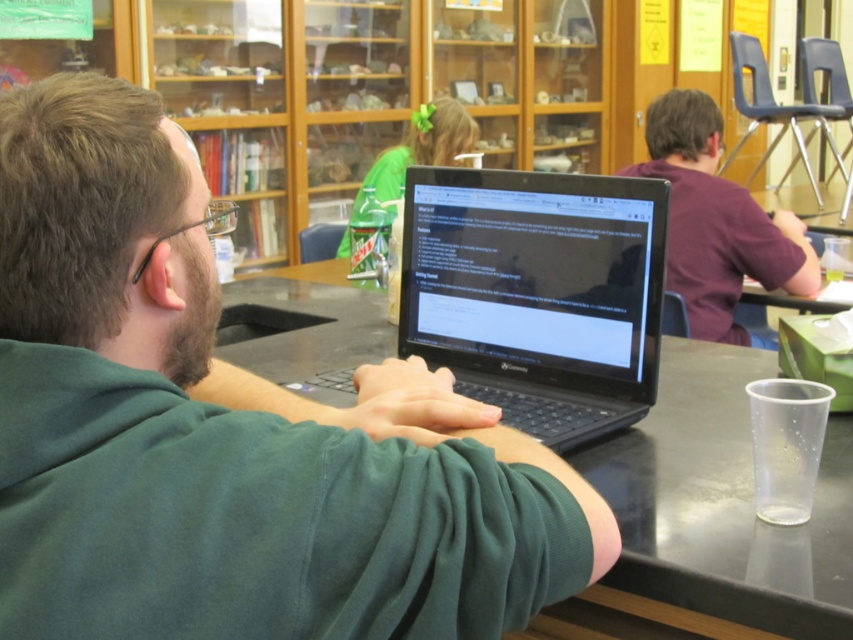
Question: Among these objects, which one is farthest from the camera?

Choices:
 (A) black glossy laptop at center
 (B) green fabric hairband at upper center
 (C) black plastic table at center

Answer: (B)

Question: Which object appears closest to the camera in this image?

Choices:
 (A) green fabric hairband at upper center
 (B) purple matte shirt at upper right

Answer: (B)

Question: Is green matte laptop at center to the right of black plastic table at center from the viewer's perspective?

Choices:
 (A) no
 (B) yes

Answer: (A)

Question: Among these points, which one is nearest to the camera?

Choices:
 (A) (718, 244)
 (B) (78, 83)

Answer: (B)

Question: In this image, where is green matte laptop at center located relative to black glossy laptop at center?

Choices:
 (A) below
 (B) above

Answer: (A)

Question: Considering the relative positions of green matte laptop at center and purple matte shirt at upper right in the image provided, where is green matte laptop at center located with respect to purple matte shirt at upper right?

Choices:
 (A) above
 (B) below

Answer: (B)